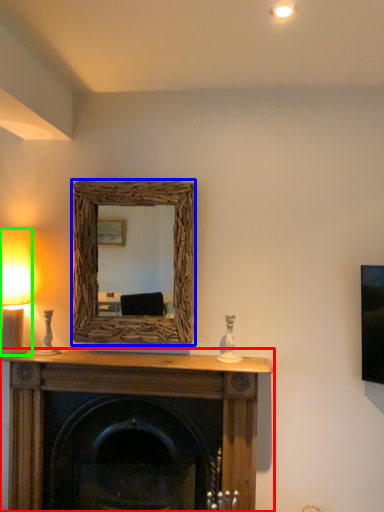
Question: Based on their relative distances, which object is nearer to fireplace (highlighted by a red box)? Choose from picture frame (highlighted by a blue box) and table lamp (highlighted by a green box).

Choices:
 (A) picture frame
 (B) table lamp

Answer: (A)